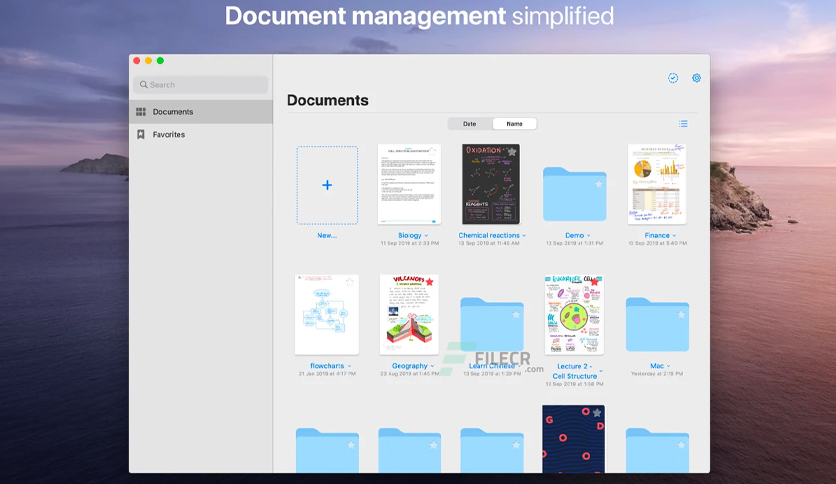
At what (x,y) coordinates should I click in order to perform the action: click on blue folders. Please return your answer as a coordinate pair (x, y). The width and height of the screenshot is (836, 484). Looking at the image, I should click on (557, 193), (644, 334), (650, 451), (497, 451), (404, 450), (318, 450), (496, 322).